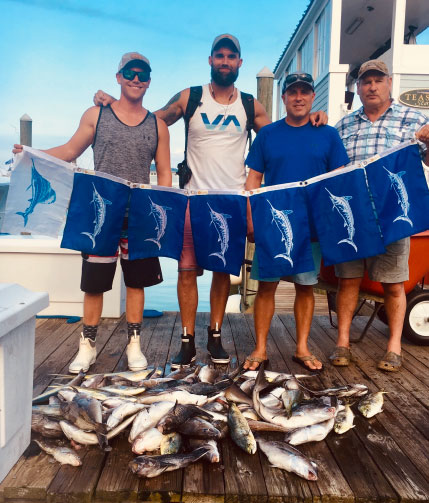
This screenshot has height=503, width=429. I want to click on wooden board, so click(x=47, y=348).